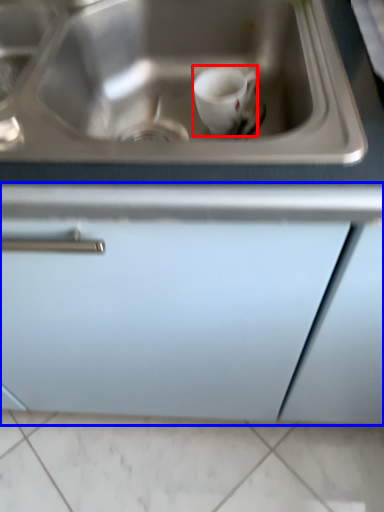
Question: Which point is further to the camera, coffee cup (highlighted by a red box) or cabinetry (highlighted by a blue box)?

Choices:
 (A) coffee cup
 (B) cabinetry

Answer: (A)